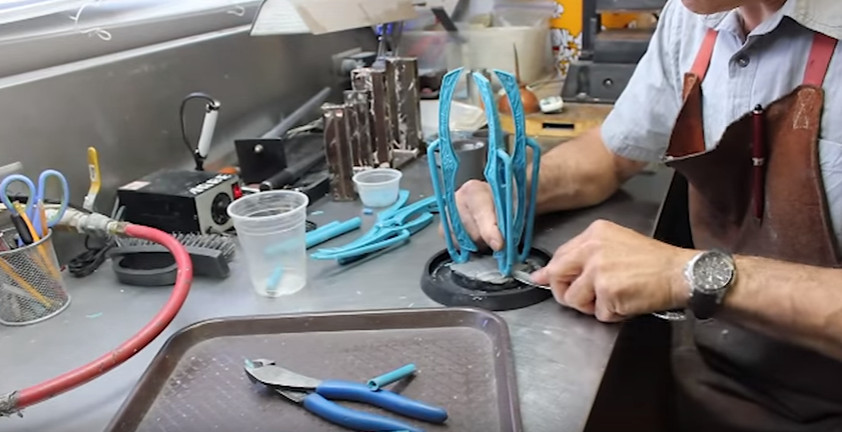
Where is `window`? The height and width of the screenshot is (432, 842). window is located at coordinates (51, 10).